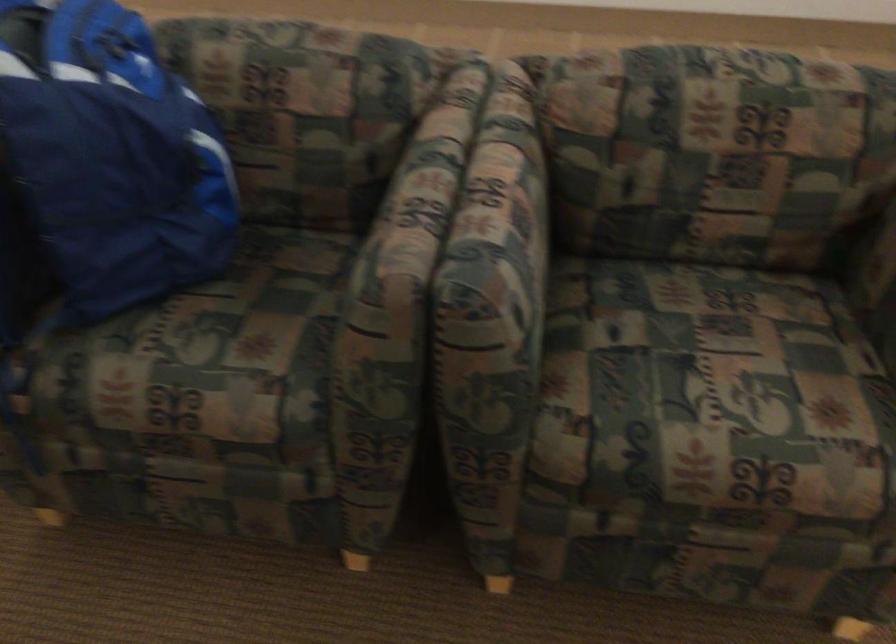
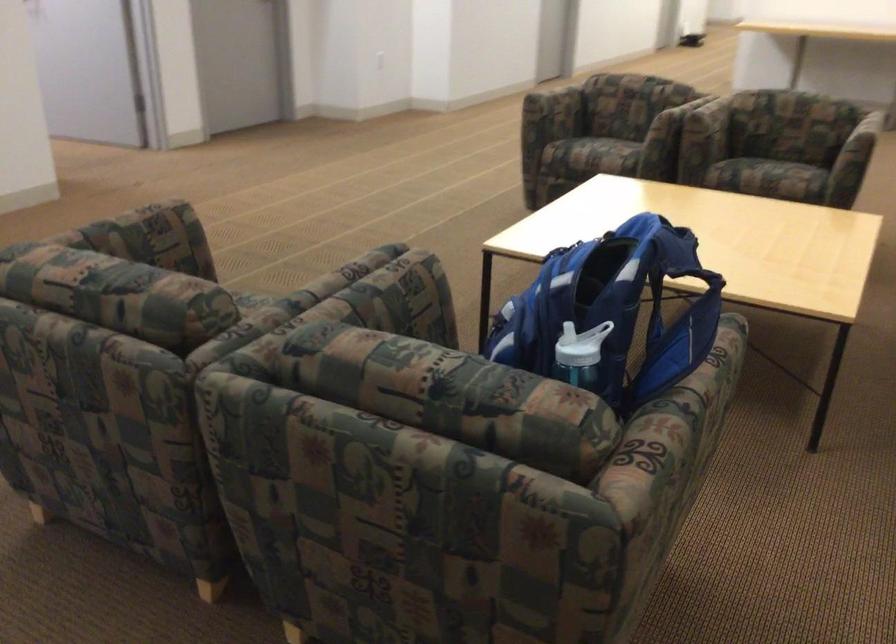
In the second image, find the point that corresponds to (416,164) in the first image.

(362, 292)